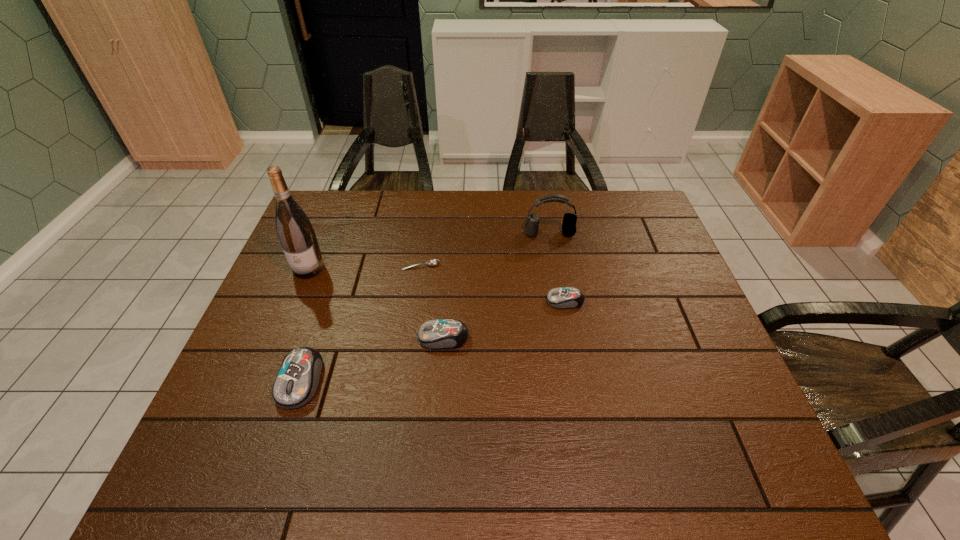
Where is `free space at the near right corner of the desktop`? The width and height of the screenshot is (960, 540). free space at the near right corner of the desktop is located at coordinates (737, 402).

The image size is (960, 540). I want to click on vacant region between the shortest computer mouse and the soupspoon, so click(x=492, y=284).

Image resolution: width=960 pixels, height=540 pixels. Find the location of `free space between the wine bottle and the soupspoon`. free space between the wine bottle and the soupspoon is located at coordinates (365, 267).

Image resolution: width=960 pixels, height=540 pixels. In order to click on empty space between the fourth tallest object and the wine bottle in this screenshot , I will do `click(376, 303)`.

I want to click on vacant area between the soupspoon and the second tallest object, so click(x=485, y=249).

At what (x,y) coordinates should I click in order to perform the action: click on free area in between the fourth farthest object and the soupspoon. Please return your answer as a coordinate pair (x, y). This screenshot has height=540, width=960. Looking at the image, I should click on (492, 284).

Identify the location of free space between the tallest object and the headset. (429, 251).

Locate an element on the screen. The height and width of the screenshot is (540, 960). empty space between the wine bottle and the leftmost computer mouse is located at coordinates (304, 325).

Where is `empty space that is in between the tallest object and the headset`? This screenshot has width=960, height=540. empty space that is in between the tallest object and the headset is located at coordinates (429, 251).

The image size is (960, 540). Identify the location of vacant region between the third tallest object and the farthest object. (425, 307).